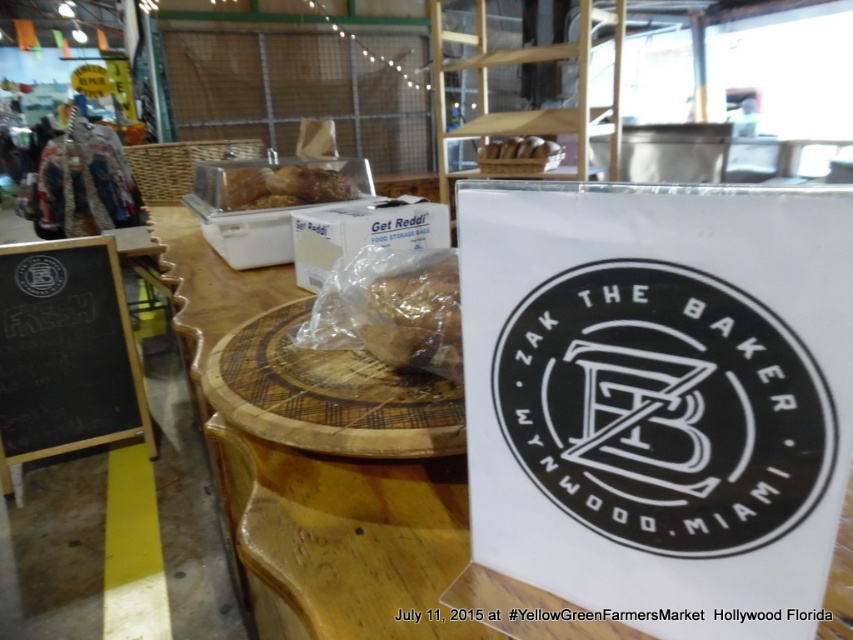
Question: Is brown crumbly bread at center to the left of translucent plastic bread at center from the viewer's perspective?

Choices:
 (A) no
 (B) yes

Answer: (A)

Question: Which point is closer to the camera?

Choices:
 (A) translucent plastic bread at center
 (B) brown paper bag at upper center

Answer: (A)

Question: Does black chalkboard at left have a lesser width compared to translucent plastic bread at center?

Choices:
 (A) no
 (B) yes

Answer: (A)

Question: Estimate the real-world distances between objects in this image. Which object is farther from the black chalkboard at left?

Choices:
 (A) brown crumbly bread at center
 (B) brown paper bag at upper center

Answer: (A)

Question: Which point is farther to the camera?

Choices:
 (A) (39, 269)
 (B) (424, 259)
 (C) (119, 342)
 (D) (247, 168)

Answer: (C)

Question: Can you confirm if white paper sign at center is positioned above black chalkboard at left?

Choices:
 (A) no
 (B) yes

Answer: (B)